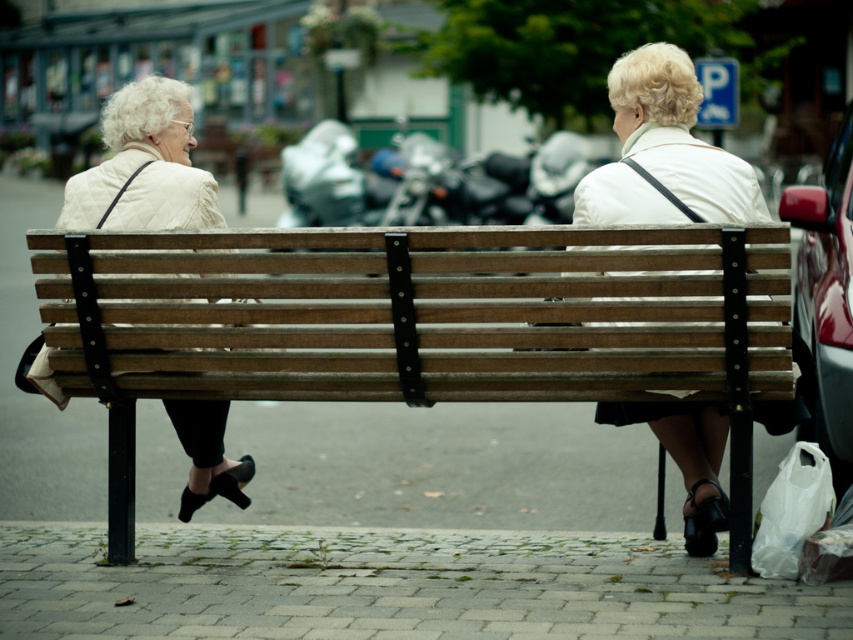
You are standing at the entrance of the town square and want to sit down on the wooden bench at center. According to the coordinates provided, is the bench positioned closer to the northern or southern end of the square?

The wooden bench at center is located at coordinates point (419, 323), which places it near the center of the square. Since it is almost exactly at the midpoint, it is equally distant from both the northern and southern ends.

You are standing in the town square and want to sit on the wooden bench at center. Is the point at coordinates point [419,323] on the bench available for you to sit?

The point [419,323] is on the wooden bench at center, so yes, the point at coordinates point [419,323] on the bench is available for you to sit.